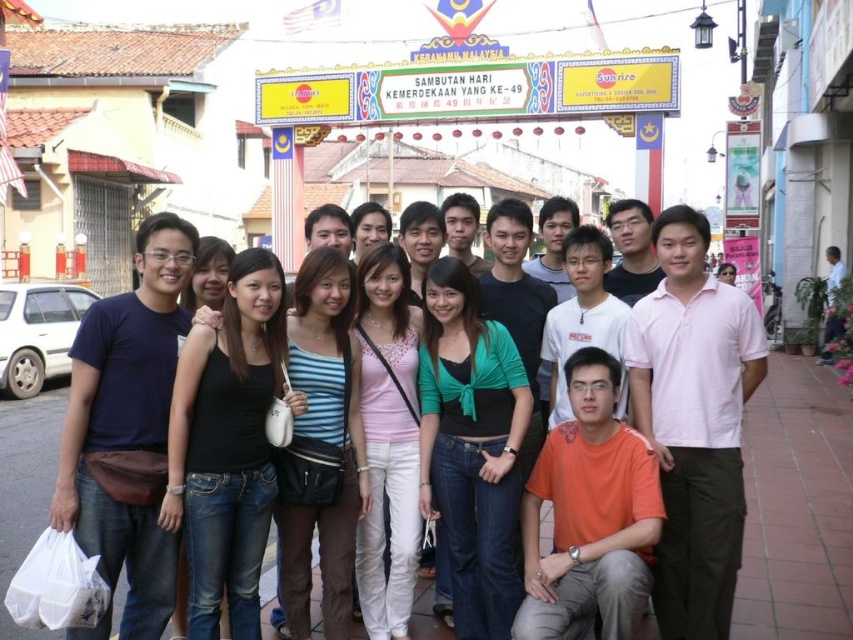
Between point (161, 600) and point (506, 260), which one is positioned behind?

Positioned behind is point (506, 260).

Is dark blue t-shirt at center bigger than black fabric shirt at center?

Incorrect, dark blue t-shirt at center is not larger than black fabric shirt at center.

Does point (94, 308) come closer to viewer compared to point (630, 285)?

Yes, point (94, 308) is closer to viewer.

The image size is (853, 640). In order to click on dark blue t-shirt at center in this screenshot , I will do `click(126, 426)`.

Which is below, black fabric shirt at center or white cotton shirt at lower right?

white cotton shirt at lower right

Which is more to the right, black fabric shirt at center or white cotton shirt at lower right?

white cotton shirt at lower right is more to the right.

Image resolution: width=853 pixels, height=640 pixels. Identify the location of black fabric shirt at center. (436, 230).

I want to click on black fabric shirt at center, so click(436, 230).

Between dark blue t-shirt at center and white cotton shirt at lower right, which one is positioned lower?

Positioned lower is dark blue t-shirt at center.

Who is more forward, (x=107, y=324) or (x=831, y=275)?

Point (x=107, y=324) is in front.

Where is `dark blue t-shirt at center`? dark blue t-shirt at center is located at coordinates (126, 426).